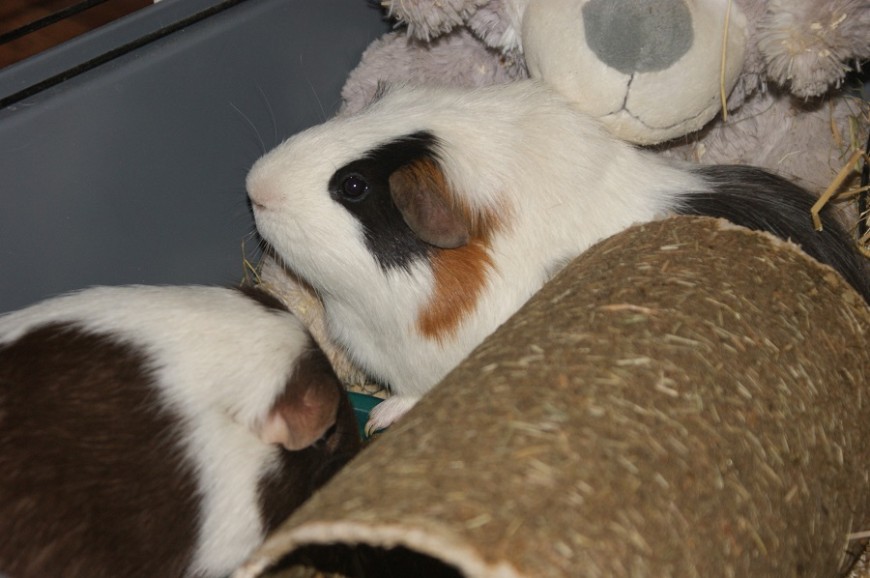
The height and width of the screenshot is (578, 870). I want to click on teddy bear, so pos(623,59).